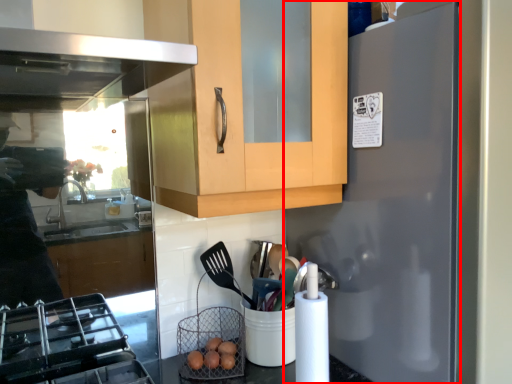
Question: In this image, where is refrigerator (annotated by the red box) located relative to basket?

Choices:
 (A) right
 (B) left

Answer: (A)